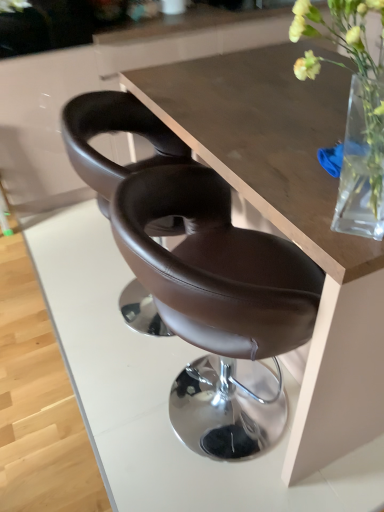
Identify the location of free space above brown leather chair at center, the 2th chair when ordered from back to front (from a real-world perspective). The width and height of the screenshot is (384, 512). (262, 170).